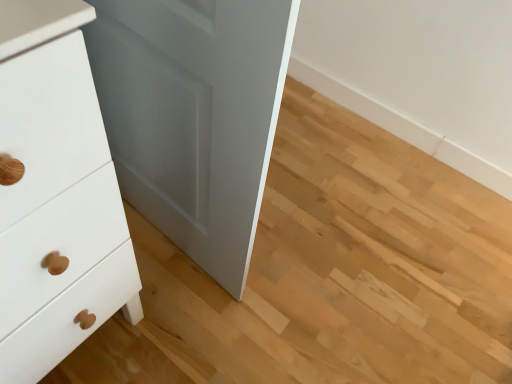
Locate an element on the screen. free location to the right of white matte wood chest of drawers at left is located at coordinates (195, 321).